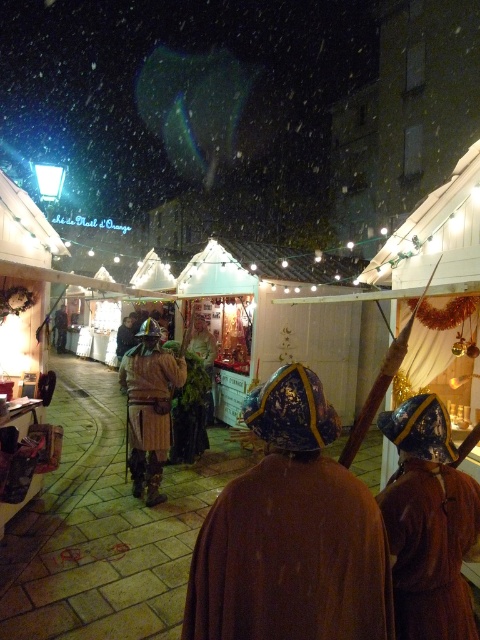
You are a medieval knight in the Christmas market. You see a brown velvet robe at center and a brown leather armor at center. Which item is positioned higher up?

The brown velvet robe at center is located above the brown leather armor at center, so it is positioned higher up.

You are a medieval knight at the market and want to approach both the brown woolen robe at center and the brown leather armor at center. Which one should you approach first if you want to start from the left side?

The brown leather armor at center is on the left side of the brown woolen robe at center, so you should approach the brown leather armor at center first.

You are a medieval merchant at the market and want to display two items side by side on a narrow shelf. The shelf is only wide enough for items that are the same width. Can you place the brown woolen robe at center and the brown leather armor at center together on the shelf?

The brown woolen robe at center is narrower than the brown leather armor at center, so they cannot be placed side by side on a shelf that requires items to be the same width.